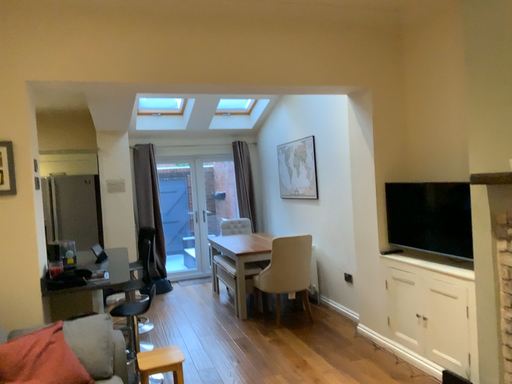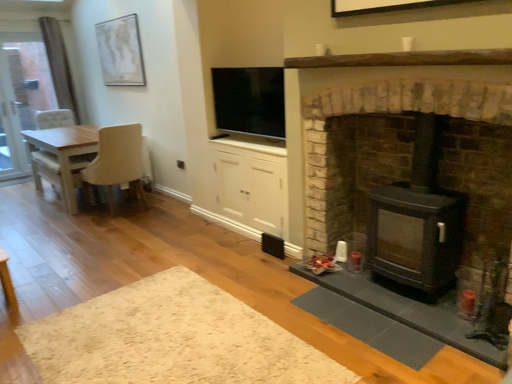
Question: How did the camera likely rotate when shooting the video?

Choices:
 (A) rotated left
 (B) rotated right

Answer: (B)